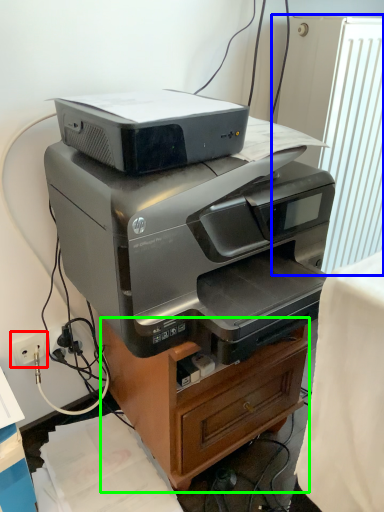
Question: Considering the real-world distances, which object is closest to electric outlet (highlighted by a red box)? radiator (highlighted by a blue box) or furniture (highlighted by a green box).

Choices:
 (A) radiator
 (B) furniture

Answer: (B)